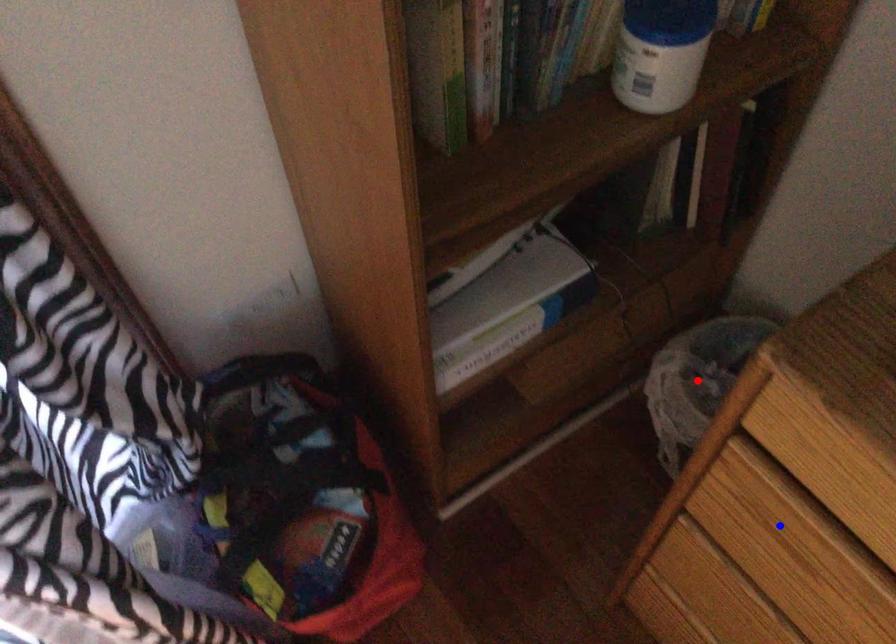
Question: In the image, two points are highlighted. Which point is nearer to the camera? Reply with the corresponding letter.

Choices:
 (A) blue point
 (B) red point

Answer: (A)